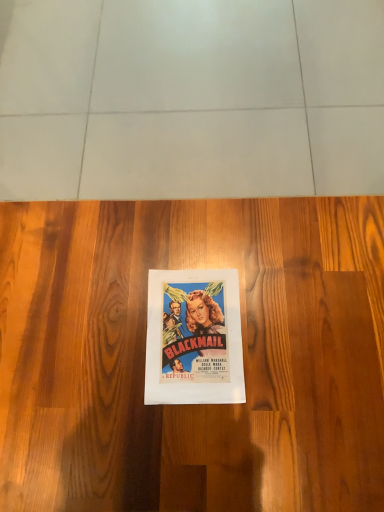
Locate an element on the screen. The image size is (384, 512). free space in front of matte paper poster at center is located at coordinates (211, 444).